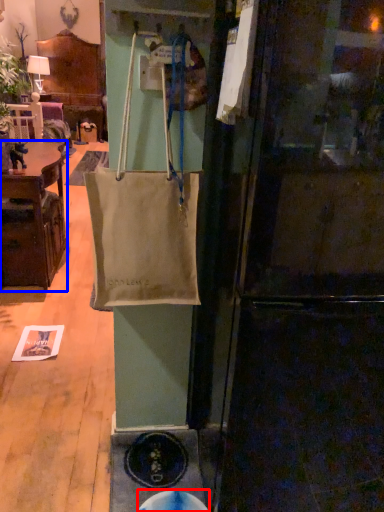
Question: Which point is further to the camera, manhole (highlighted by a red box) or cabinetry (highlighted by a blue box)?

Choices:
 (A) manhole
 (B) cabinetry

Answer: (B)